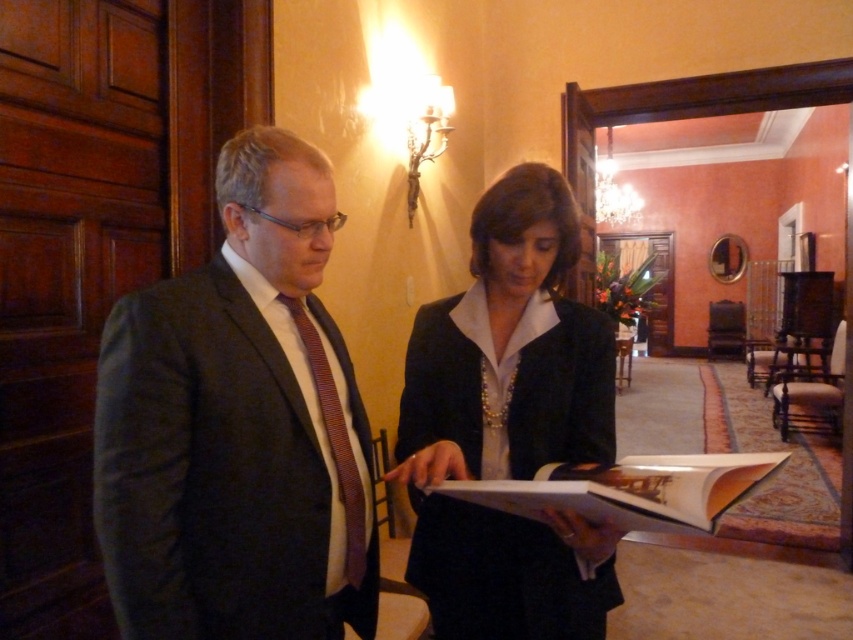
From the picture: Who is shorter, matte black blazer at center or white paper book at center?

With less height is white paper book at center.

What do you see at coordinates (509, 426) in the screenshot? The width and height of the screenshot is (853, 640). I see `matte black blazer at center` at bounding box center [509, 426].

Find the location of `matte black blazer at center`. matte black blazer at center is located at coordinates (509, 426).

What do you see at coordinates (236, 426) in the screenshot? I see `dark gray suit at center` at bounding box center [236, 426].

Image resolution: width=853 pixels, height=640 pixels. Identify the location of dark gray suit at center. (236, 426).

Where is `dark gray suit at center`? The width and height of the screenshot is (853, 640). dark gray suit at center is located at coordinates (236, 426).

Is point (477, 560) closer to camera compared to point (343, 481)?

No, it is behind (343, 481).

Is matte black blazer at center further to the viewer compared to striped silk tie at left?

No, it is in front of striped silk tie at left.

Is point (496, 545) behind point (357, 566)?

Yes.

Identify the location of matte black blazer at center. The height and width of the screenshot is (640, 853). coord(509,426).